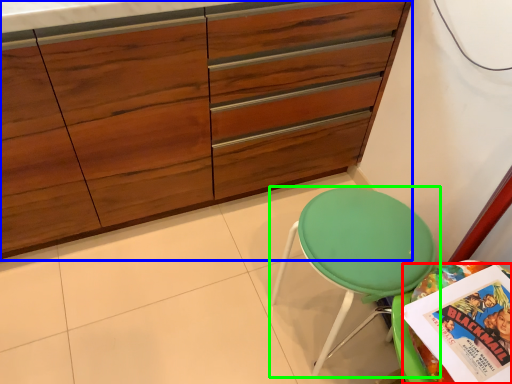
Question: Considering the real-world distances, which object is farthest from comic book (highlighted by a red box)? cabinetry (highlighted by a blue box) or chair (highlighted by a green box)?

Choices:
 (A) cabinetry
 (B) chair

Answer: (A)